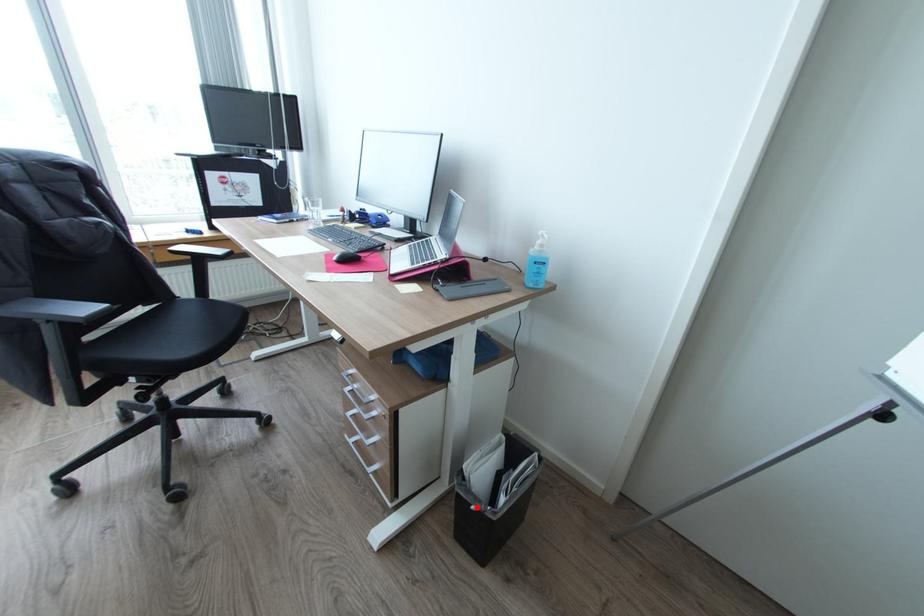
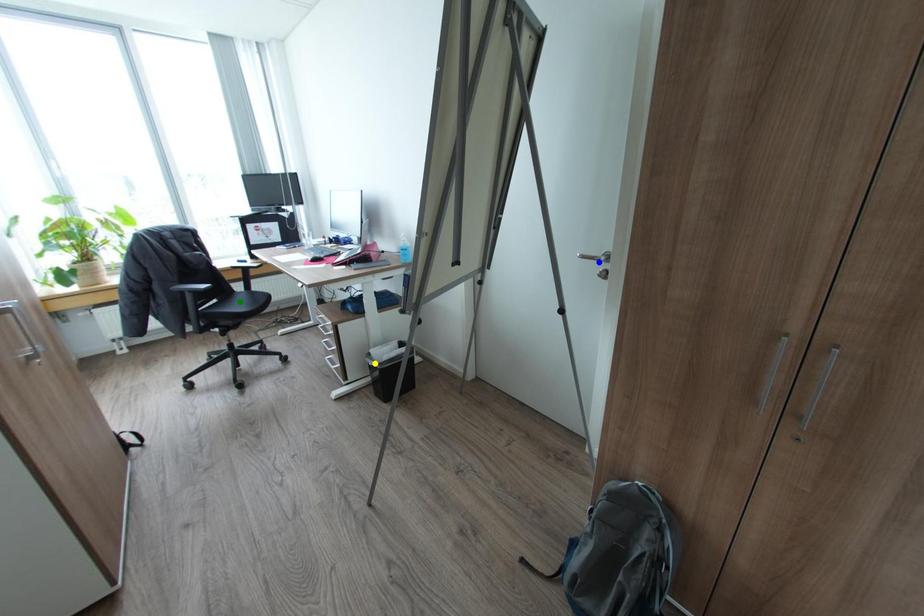
Question: I am providing you with two images of the same scene from different viewpoints. A red point is marked on the first image. You are given multiple points on the second image. In image 2, which mark is for the same physical point as the one in image 1?

Choices:
 (A) yellow point
 (B) blue point
 (C) green point

Answer: (A)